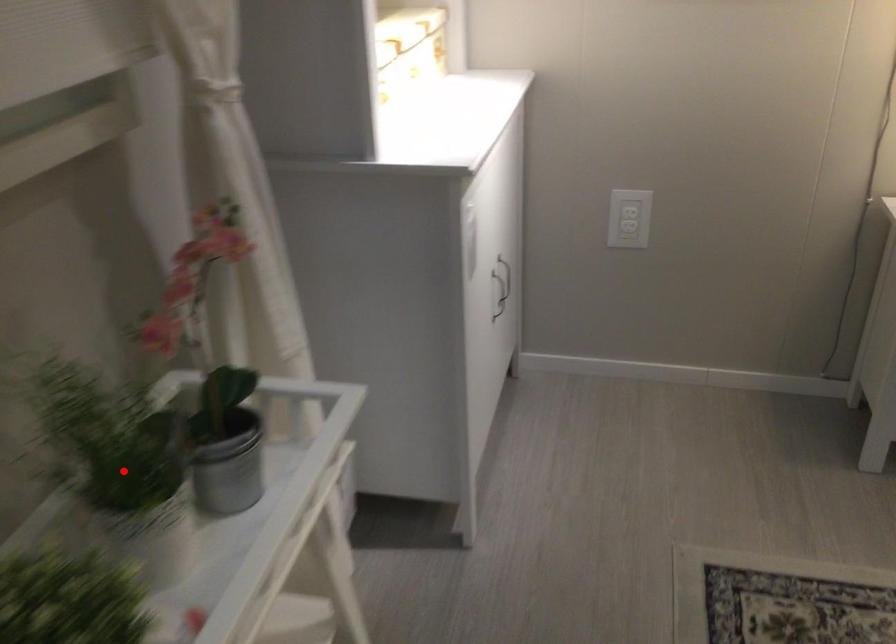
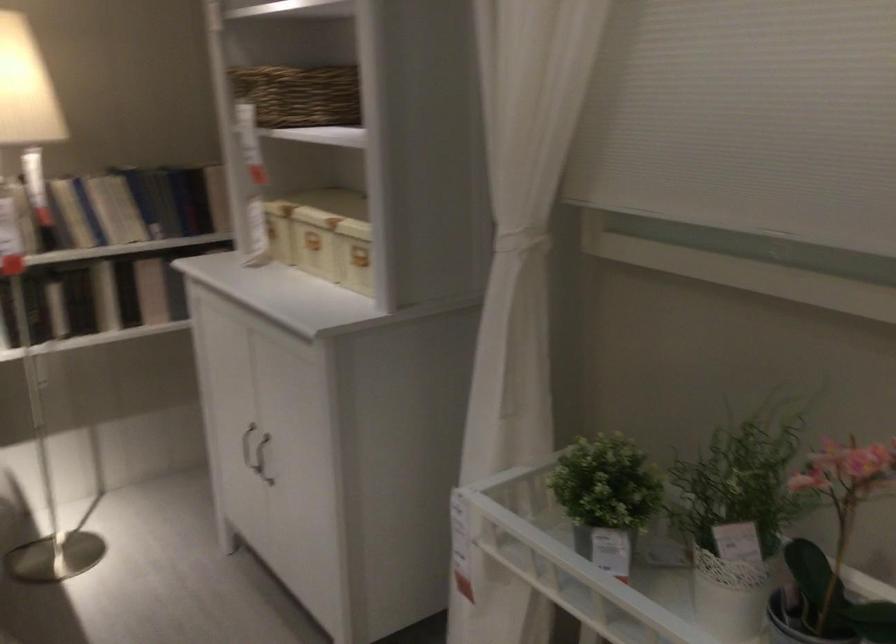
Question: I am providing you with two images of the same scene from different viewpoints. Image1 has a red point marked. In image2, the corresponding 3D location appears at what relative position? Reply with the corresponding letter.

Choices:
 (A) Closer
 (B) Farther

Answer: (B)